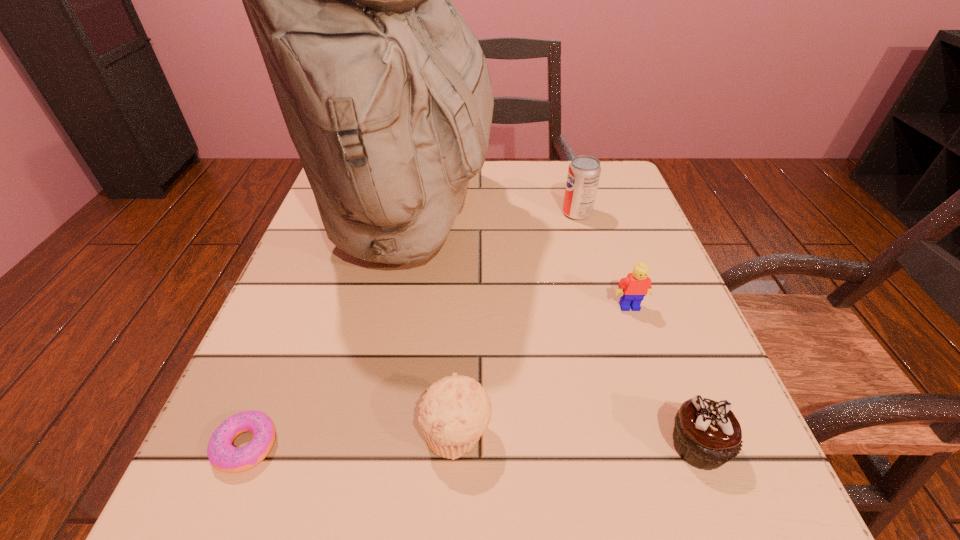
You are a GUI agent. You are given a task and a screenshot of the screen. Output one action in this format:
    pyautogui.click(x=<x>, y=<y>)
    Task: Click on the backpack
    
    Given the screenshot: What is the action you would take?
    coord(385,91)

The width and height of the screenshot is (960, 540). Identify the location of soda. (584, 171).

At what (x,y) coordinates should I click in order to perform the action: click on Lego. Please return your answer as a coordinate pair (x, y). Looking at the image, I should click on (633, 288).

This screenshot has width=960, height=540. I want to click on muffin, so click(455, 412).

Locate an element on the screen. The width and height of the screenshot is (960, 540). cupcake is located at coordinates (707, 434).

The image size is (960, 540). I want to click on the shortest object, so click(x=226, y=458).

The image size is (960, 540). I want to click on free spot located on the front-facing side of the tallest object, so [580, 221].

Where is `free space located on the left of the soda`? The width and height of the screenshot is (960, 540). free space located on the left of the soda is located at coordinates point(445,213).

Where is `free space located 0.160m on the front-facing side of the Lego`? This screenshot has width=960, height=540. free space located 0.160m on the front-facing side of the Lego is located at coordinates (659, 392).

Where is `blank space located on the front of the muffin`? This screenshot has width=960, height=540. blank space located on the front of the muffin is located at coordinates (453, 529).